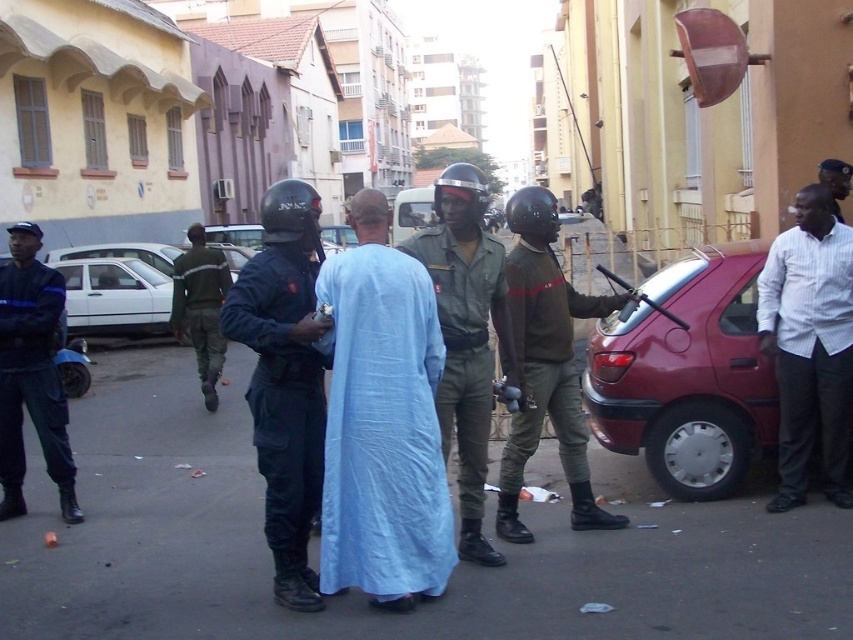
Is white striped shirt at right wider than white matte car at left?

No.

Is point (801, 275) behind point (86, 269)?

No, it is not.

Where is `white striped shirt at right`? This screenshot has width=853, height=640. white striped shirt at right is located at coordinates (809, 344).

Can you confirm if white striped shirt at right is wider than dark brown leather jacket at center?

In fact, white striped shirt at right might be narrower than dark brown leather jacket at center.

Is point (793, 227) behind point (564, 412)?

Yes, it is.

Locate an element on the screen. The image size is (853, 640). white striped shirt at right is located at coordinates (809, 344).

Which is in front, point (462, 483) or point (202, 262)?

Positioned in front is point (462, 483).

Is the position of green uniform helmet at center less distant than that of green uniform at center?

Yes, it is in front of green uniform at center.

This screenshot has height=640, width=853. In order to click on green uniform helmet at center in this screenshot , I will do pos(467,337).